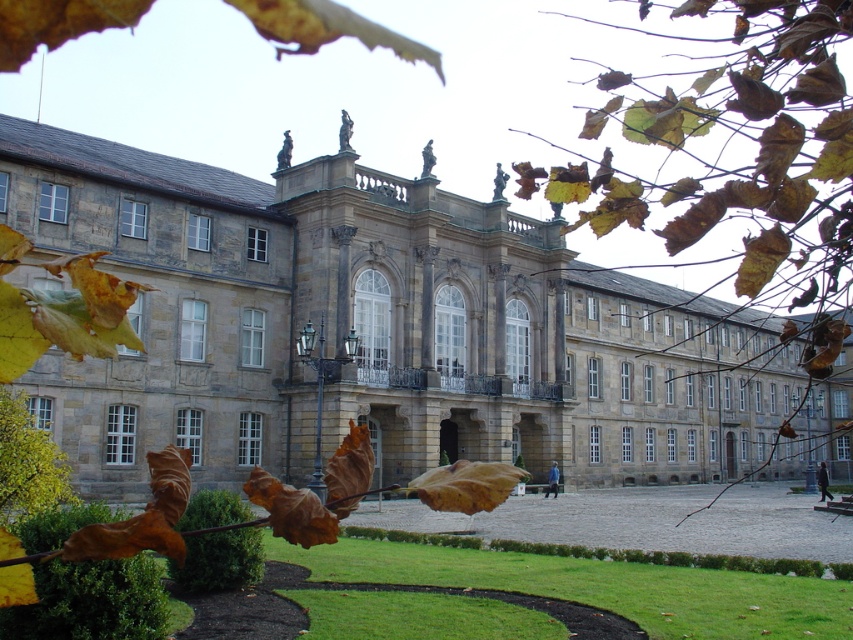
You are an architect visiting the historical site and want to take a photo of the stone gray building at center and the brown leafy branch at upper center. Which object should you focus on first if you want to capture both in a single frame without zooming in or out?

The stone gray building at center is wider than the brown leafy branch at upper center, so you should focus on the stone gray building at center first to ensure it fits within the frame while still capturing the brown leafy branch at upper center.

You are standing on the lawn in front of the stone gray building at center and looking towards the brown leafy branch at upper center. Which object appears closer to you?

The brown leafy branch at upper center appears closer to you because it is larger than the stone gray building at center, indicating it is nearer in the scene.